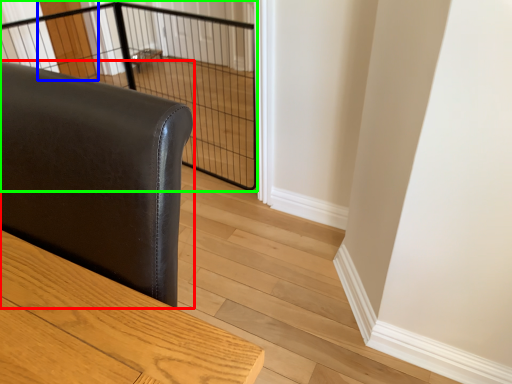
Question: Which object is positioned closest to furniture (highlighted by a red box)? Select from screen door (highlighted by a blue box) and cage (highlighted by a green box).

Choices:
 (A) screen door
 (B) cage

Answer: (B)